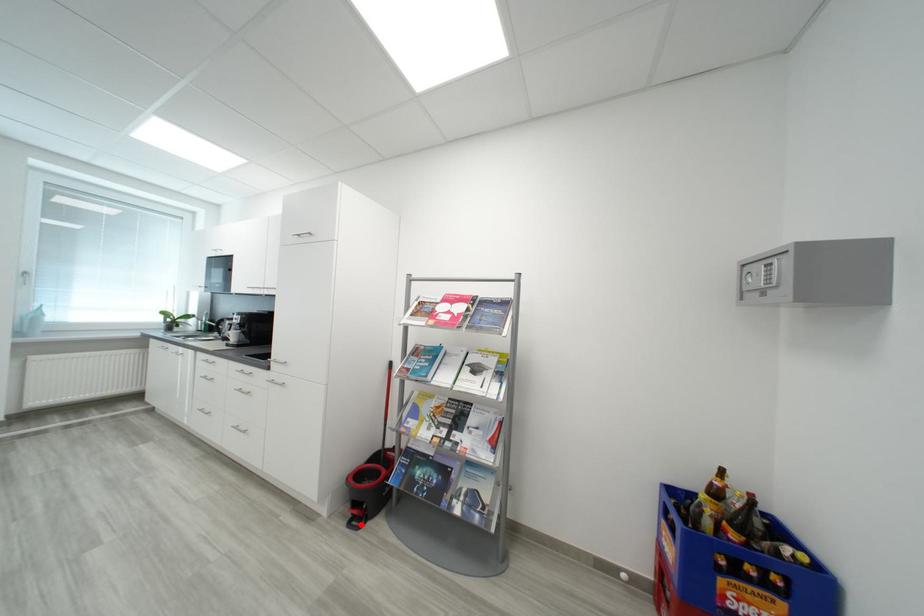
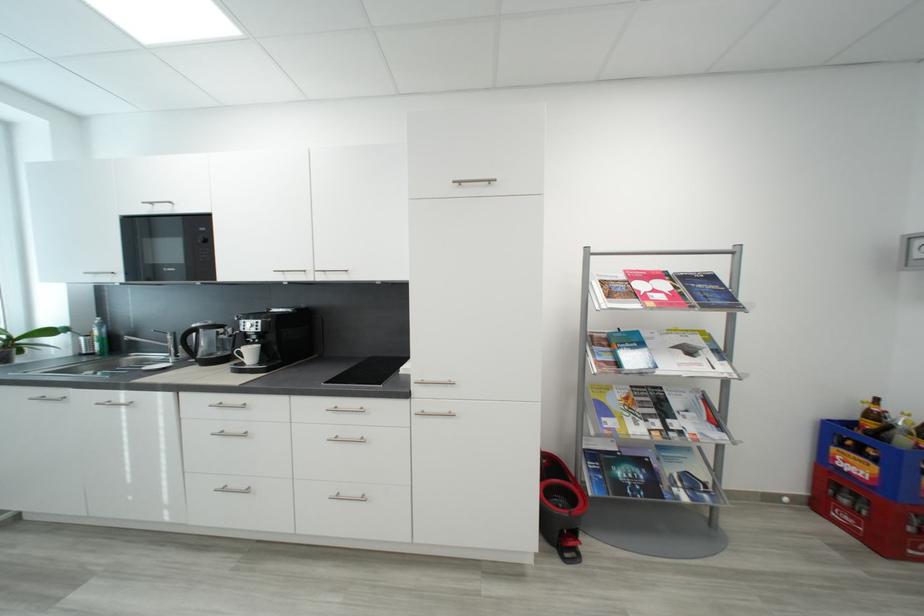
Locate, in the second image, the point that corresponds to the highlighted location in the first image.

(574, 557)